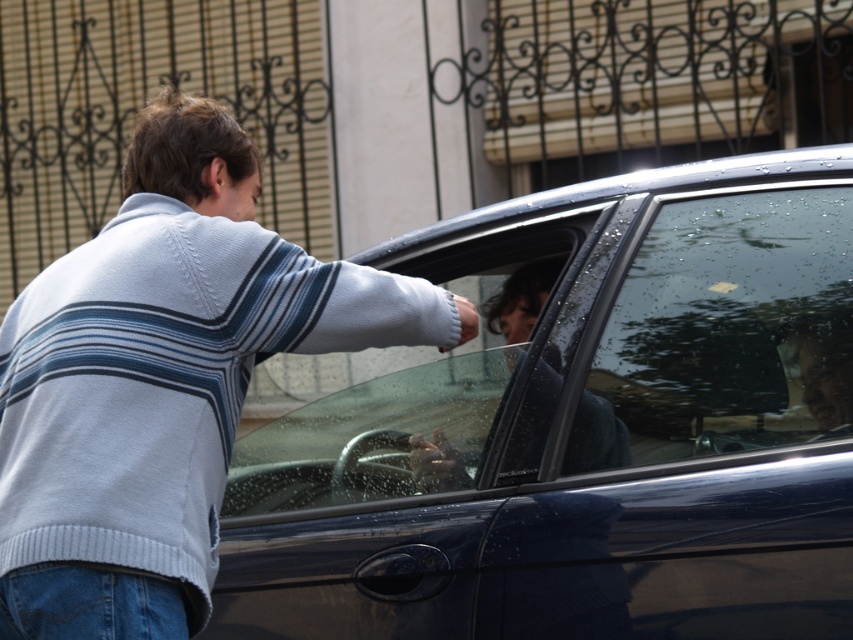
Question: Does light blue sweater at center appear on the left side of transparent glass windshield at center?

Choices:
 (A) no
 (B) yes

Answer: (B)

Question: Which of the following is the farthest from the observer?

Choices:
 (A) (567, 243)
 (B) (212, 198)
 (C) (602, 253)

Answer: (A)

Question: Is glossy dark blue car at center smaller than light blue sweater at center?

Choices:
 (A) no
 (B) yes

Answer: (A)

Question: Is light blue sweater at center thinner than transparent glass windshield at center?

Choices:
 (A) yes
 (B) no

Answer: (B)

Question: Which point is farther to the camera?

Choices:
 (A) (21, 356)
 (B) (405, 586)
 (C) (688, 420)
 (D) (293, 467)

Answer: (D)

Question: Which of these objects is positioned closest to the transparent glass windshield at center?

Choices:
 (A) transparent glass car window at center
 (B) glossy dark blue car at center

Answer: (B)